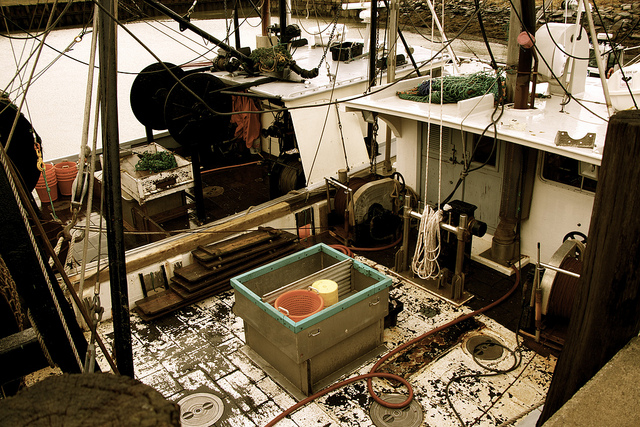
This screenshot has height=427, width=640. In order to click on vent in this screenshot , I will do `click(561, 39)`.